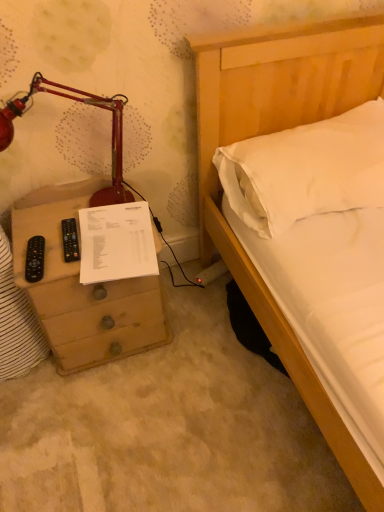
Question: Is matte red lamp at left to the right of black plastic remote at left from the viewer's perspective?

Choices:
 (A) no
 (B) yes

Answer: (B)

Question: Is there a large distance between matte red lamp at left and black plastic remote at left?

Choices:
 (A) no
 (B) yes

Answer: (A)

Question: Does matte red lamp at left turn towards black plastic remote at left?

Choices:
 (A) yes
 (B) no

Answer: (A)

Question: From the image's perspective, does matte red lamp at left appear higher than black plastic remote at left?

Choices:
 (A) no
 (B) yes

Answer: (B)

Question: From a real-world perspective, is matte red lamp at left on black plastic remote at left?

Choices:
 (A) yes
 (B) no

Answer: (A)

Question: Does matte red lamp at left have a lesser height compared to black plastic remote at left?

Choices:
 (A) yes
 (B) no

Answer: (B)

Question: Can you confirm if white paper at left is thinner than black plastic remote at left?

Choices:
 (A) no
 (B) yes

Answer: (A)

Question: Is black plastic remote at left located within white paper at left?

Choices:
 (A) yes
 (B) no

Answer: (B)

Question: Does white paper at left come behind black plastic remote at left?

Choices:
 (A) no
 (B) yes

Answer: (A)

Question: Is white paper at left oriented away from black plastic remote at left?

Choices:
 (A) yes
 (B) no

Answer: (B)

Question: Does white paper at left touch black plastic remote at left?

Choices:
 (A) yes
 (B) no

Answer: (B)

Question: Is white paper at left positioned before black plastic remote at left?

Choices:
 (A) yes
 (B) no

Answer: (A)

Question: From a real-world perspective, is wooden chest of drawers at left on top of black plastic remote at left?

Choices:
 (A) no
 (B) yes

Answer: (A)